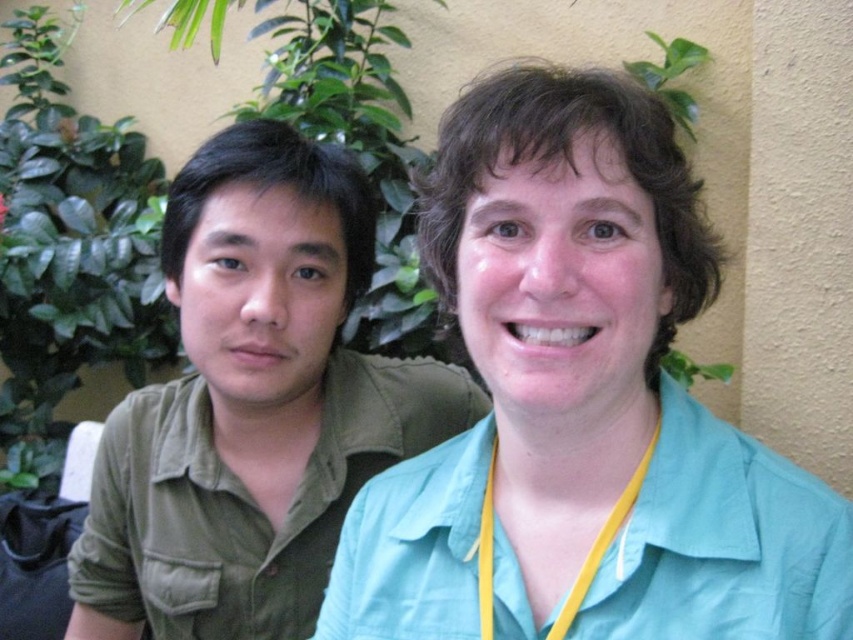
Question: Does yellow fabric lanyard at center appear on the left side of yellow fabric at center?

Choices:
 (A) yes
 (B) no

Answer: (A)

Question: Considering the real-world distances, which object is closest to the teal fabric shirt at center?

Choices:
 (A) yellow fabric lanyard at center
 (B) green matte shirt at left

Answer: (A)

Question: Which point is closer to the camera taking this photo?

Choices:
 (A) (354, 508)
 (B) (488, 544)

Answer: (B)

Question: Considering the real-world distances, which object is closest to the green leafy plant at upper right?

Choices:
 (A) yellow fabric lanyard at center
 (B) green leafy plant at left
 (C) teal fabric shirt at center
 (D) green matte shirt at left

Answer: (D)

Question: Is teal fabric shirt at center to the right of green leafy plant at left from the viewer's perspective?

Choices:
 (A) no
 (B) yes

Answer: (B)

Question: Can you confirm if green matte shirt at left is positioned to the left of yellow fabric at center?

Choices:
 (A) no
 (B) yes

Answer: (B)